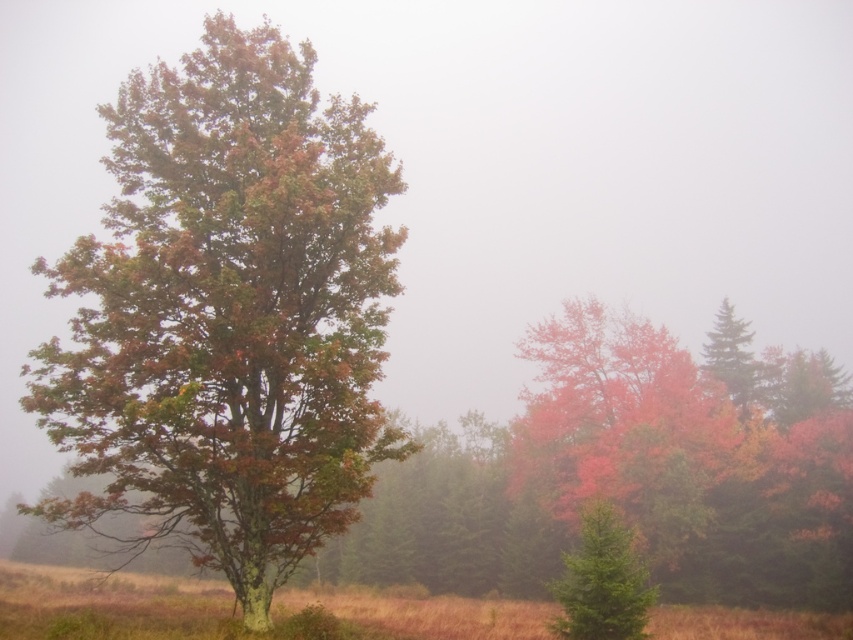
Question: Does green matte evergreen at lower right appear on the right side of green matte tree at upper right?

Choices:
 (A) no
 (B) yes

Answer: (A)

Question: Among these objects, which one is nearest to the camera?

Choices:
 (A) green matte evergreen at lower right
 (B) multicolored foliage tree at left

Answer: (B)

Question: Estimate the real-world distances between objects in this image. Which object is farther from the multicolored foliage tree at left?

Choices:
 (A) green matte tree at upper right
 (B) green matte evergreen at lower right

Answer: (A)

Question: Is the position of green matte evergreen at lower right less distant than that of green matte tree at upper right?

Choices:
 (A) no
 (B) yes

Answer: (B)

Question: Which point is farther from the camera taking this photo?

Choices:
 (A) (345, 109)
 (B) (704, 371)

Answer: (B)

Question: Is green matte evergreen at lower right wider than green matte tree at upper right?

Choices:
 (A) yes
 (B) no

Answer: (A)